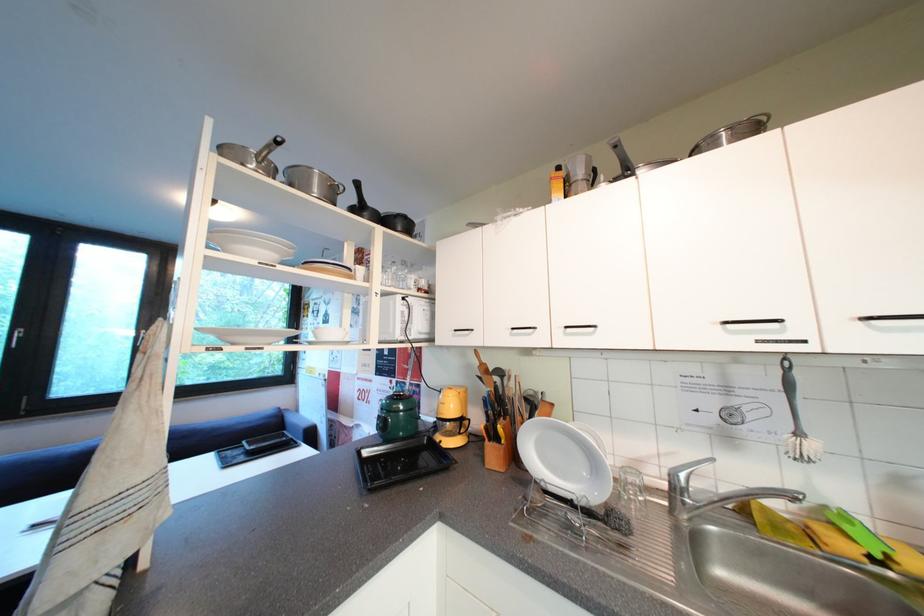
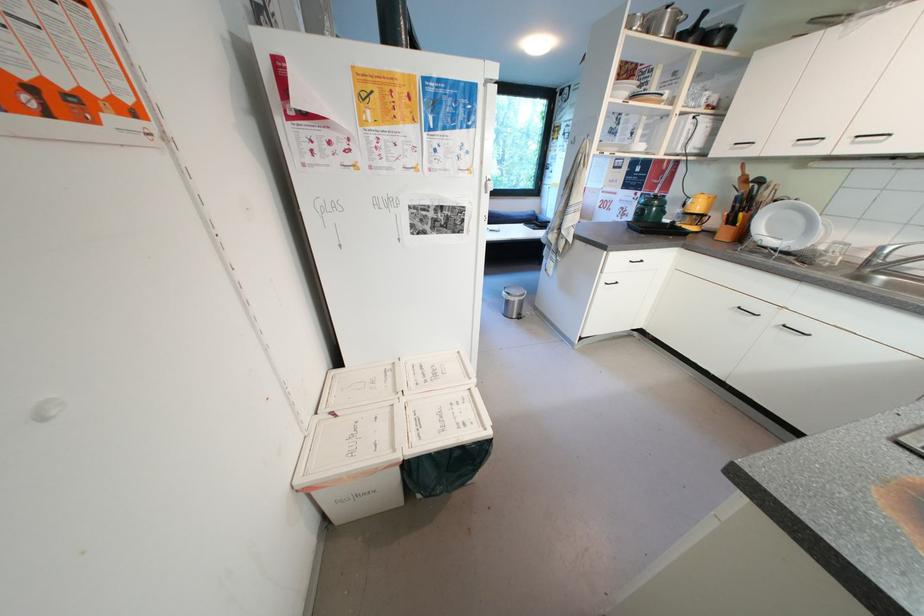
Locate, in the second image, the point that corresponds to (x=402, y=383) in the first image.

(647, 196)